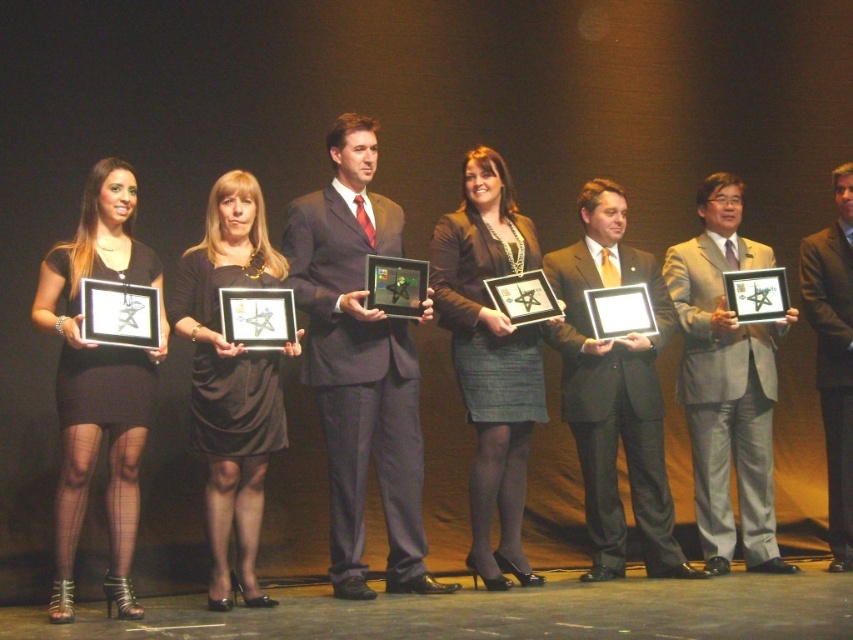
Between matte black suit at center and dark gray suit at center, which one has more height?

With more height is matte black suit at center.

Who is more forward, (364, 154) or (840, 396)?

Point (364, 154)

Is point (383, 330) positioned after point (844, 371)?

No, (383, 330) is closer to viewer.

Locate an element on the screen. matte black suit at center is located at coordinates (358, 365).

Which of these two, gray suit at center or dark gray suit at center, stands taller?

With more height is dark gray suit at center.

Between point (693, 353) and point (833, 458), which one is positioned behind?

The point (693, 353) is more distant.

Find the location of a particular element. gray suit at center is located at coordinates (726, 381).

The image size is (853, 640). I want to click on matte gray suit at center, so click(614, 392).

Describe the element at coordinates (614, 392) in the screenshot. Image resolution: width=853 pixels, height=640 pixels. I see `matte gray suit at center` at that location.

Where is `matte gray suit at center`? matte gray suit at center is located at coordinates (614, 392).